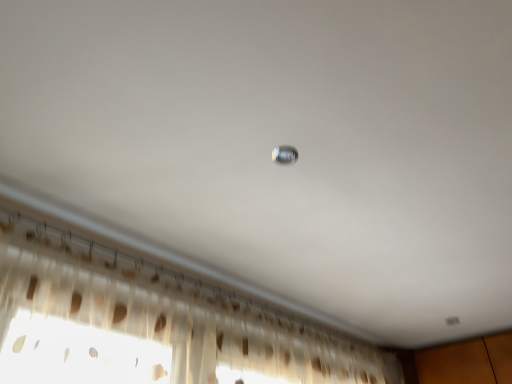
The image size is (512, 384). I want to click on translucent fabric curtain at lower left, so click(153, 322).

Image resolution: width=512 pixels, height=384 pixels. Describe the element at coordinates (153, 322) in the screenshot. I see `translucent fabric curtain at lower left` at that location.

Locate an element on the screen. translucent fabric curtain at lower left is located at coordinates (153, 322).